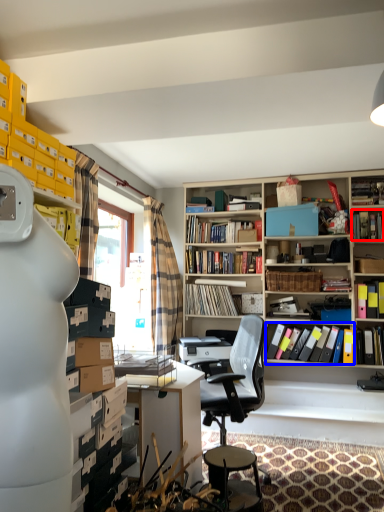
Question: Among these objects, which one is nearest to the camera, book (highlighted by a red box) or book (highlighted by a blue box)?

Choices:
 (A) book
 (B) book

Answer: (B)